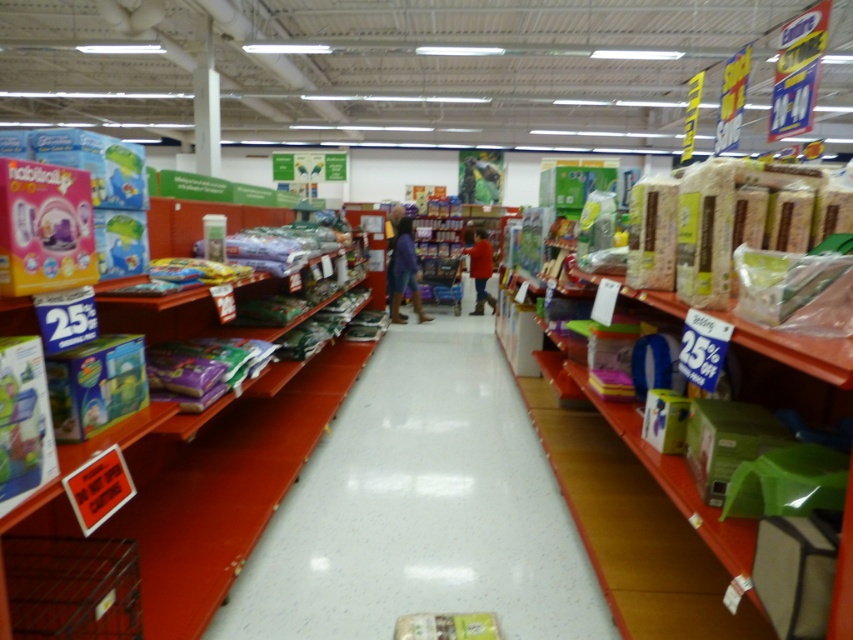
You are a customer in the store and want to pick up both the blue fabric pants at center and the red sweater at center. Can you reach both items without moving your position?

The blue fabric pants at center and the red sweater at center are 1.32 meters apart, so you can reach both items without moving your position since the distance between them is within a comfortable arm span.

From the picture: You are a customer in the store and want to reach the red sweater at center. There is a blue fabric pants at center in your way. Can you move the pants to access the sweater?

The blue fabric pants at center is below the red sweater at center, so you can easily reach the red sweater at center without moving the pants.

You are a store employee who needs to place a new red sweater at center and a dark brown leather jacket at center on a shelf. The shelf has a width of 1.2 meters. Can both items fit side by side without overlapping?

The red sweater at center is wider than the dark brown leather jacket at center. However, since the total width of both items combined is not provided, it is impossible to determine if they can fit side by side on the 1.2 meters shelf without overlapping.